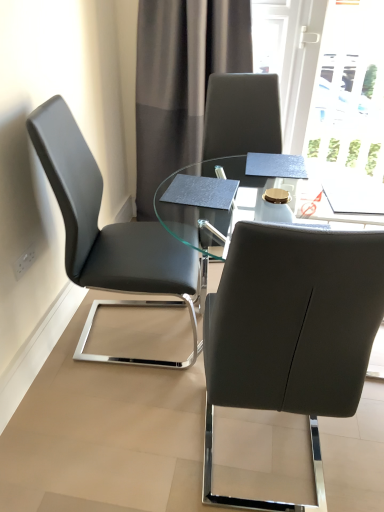
Question: Relative to gray fabric curtain at upper center, is transparent glass table at center in front or behind?

Choices:
 (A) behind
 (B) front

Answer: (B)

Question: Is transparent glass table at center wider or thinner than gray fabric curtain at upper center?

Choices:
 (A) wide
 (B) thin

Answer: (A)

Question: Which of these objects is positioned farthest from the gray fabric curtain at upper center?

Choices:
 (A) matte black chair at center, the second chair when ordered from left to right
 (B) transparent glass table at center
 (C) matte black chair at left, arranged as the 2th chair when viewed from the right

Answer: (A)

Question: Which object is the closest to the matte black chair at center, the first chair when ordered from right to left?

Choices:
 (A) gray fabric curtain at upper center
 (B) transparent glass table at center
 (C) matte black chair at left, arranged as the 2th chair when viewed from the right

Answer: (C)